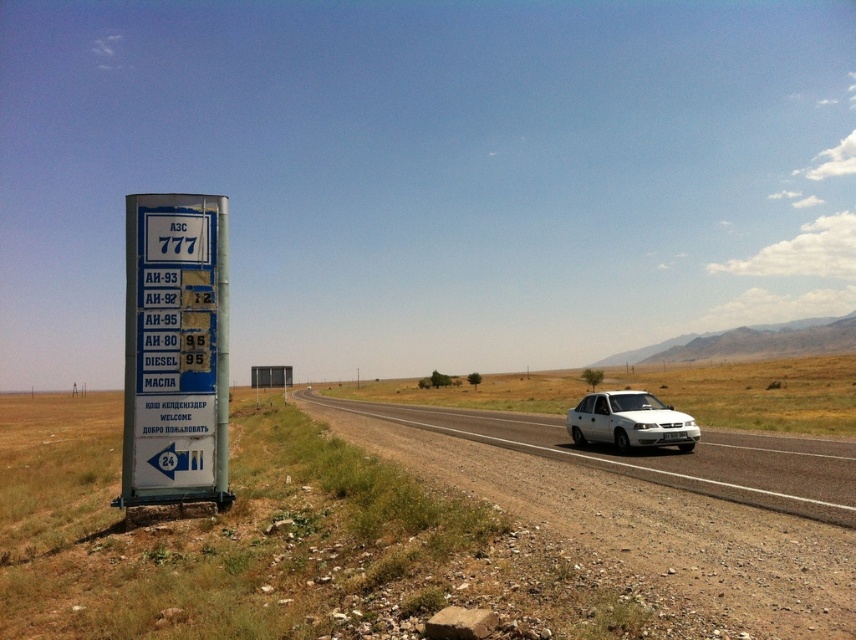
Can you confirm if blue plastic sign at left is thinner than white matte sedan at right?

Indeed, blue plastic sign at left has a lesser width compared to white matte sedan at right.

Does blue plastic sign at left have a larger size compared to white matte sedan at right?

No, blue plastic sign at left is not bigger than white matte sedan at right.

Which is in front, point (221, 481) or point (669, 410)?

Point (221, 481) is in front.

You are a GUI agent. You are given a task and a screenshot of the screen. Output one action in this format:
    pyautogui.click(x=<x>, y=<y>)
    Task: Click on the blue plastic sign at left
    Image resolution: width=856 pixels, height=640 pixels.
    Given the screenshot: What is the action you would take?
    pyautogui.click(x=175, y=349)

Who is higher up, white glossy car at center or white matte sedan at right?

white matte sedan at right

Is point (742, 442) farther from viewer compared to point (568, 426)?

No.

Where is `white glossy car at center`? white glossy car at center is located at coordinates (660, 456).

Between point (140, 320) and point (853, 484), which one is positioned in front?

Point (853, 484) is in front.

Which is behind, point (205, 376) or point (801, 461)?

Point (801, 461)

Does point (214, 385) lie in front of point (696, 490)?

No, it is not.

At what (x,y) coordinates should I click in order to perform the action: click on blue plastic sign at left. Please return your answer as a coordinate pair (x, y). This screenshot has height=640, width=856. Looking at the image, I should click on (175, 349).